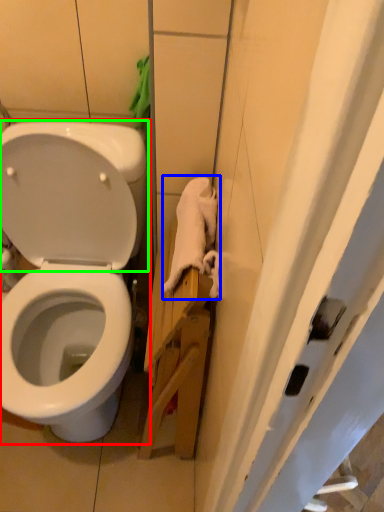
Question: Which is farther away from toilet (highlighted by a red box)? material (highlighted by a blue box) or back (highlighted by a green box)?

Choices:
 (A) material
 (B) back

Answer: (A)